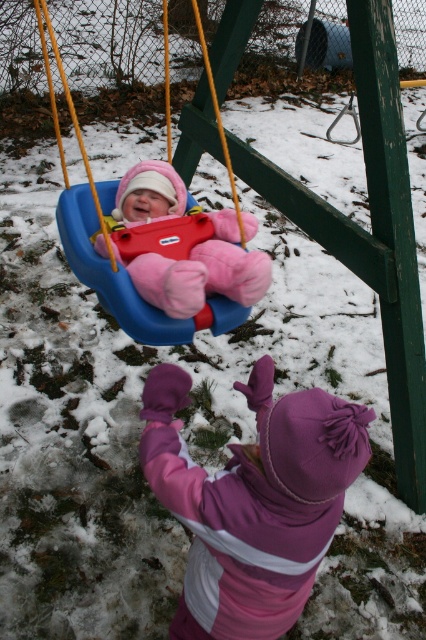
Question: Estimate the real-world distances between objects in this image. Which object is closer to the purple fleece mittens at lower center?

Choices:
 (A) pink fleece baby at center
 (B) blue plastic swing at center

Answer: (A)

Question: Which of the following is the closest to the observer?

Choices:
 (A) (150, 160)
 (B) (244, 540)

Answer: (B)

Question: Is pink fleece baby at center thinner than blue plastic swing at center?

Choices:
 (A) no
 (B) yes

Answer: (A)

Question: Can you confirm if purple fleece mittens at lower center is bigger than pink fleece baby at center?

Choices:
 (A) no
 (B) yes

Answer: (B)

Question: Where is purple fleece mittens at lower center located in relation to blue plastic swing at center in the image?

Choices:
 (A) right
 (B) left

Answer: (A)

Question: Which point appears farthest from the camera in this image?

Choices:
 (A) (212, 259)
 (B) (253, 598)

Answer: (A)